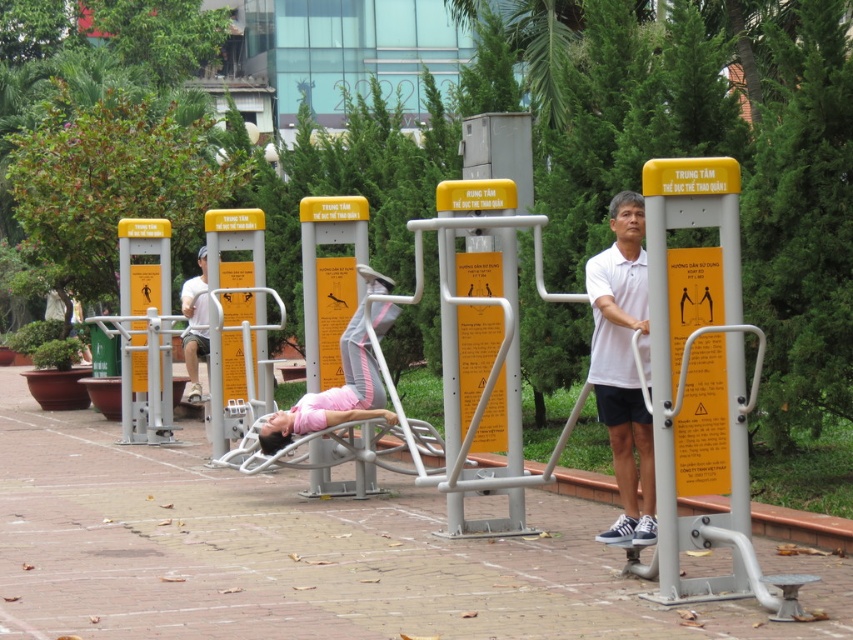
What is the relationship between the white matte shirt at center and the matte white shirt at center in terms of their positions?

The white matte shirt at center is positioned to the right of the matte white shirt at center.

Consider the image. You are a park visitor who wants to locate the white matte shirt at center. Based on the scene description, where would you look to find it?

The white matte shirt at center is located at the 2D coordinates point (624, 364), which is in the central area of the image.